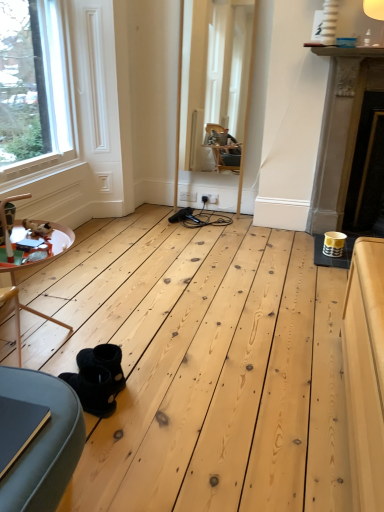
Question: Does clear glass window at upper left have a lesser width compared to gold metallic fireplace at right?

Choices:
 (A) yes
 (B) no

Answer: (A)

Question: From the image's perspective, is clear glass window at upper left located beneath gold metallic fireplace at right?

Choices:
 (A) yes
 (B) no

Answer: (B)

Question: Is clear glass window at upper left outside of gold metallic fireplace at right?

Choices:
 (A) no
 (B) yes

Answer: (B)

Question: Is clear glass window at upper left at the left side of gold metallic fireplace at right?

Choices:
 (A) yes
 (B) no

Answer: (A)

Question: Is clear glass window at upper left oriented towards gold metallic fireplace at right?

Choices:
 (A) yes
 (B) no

Answer: (A)

Question: From a real-world perspective, relative to wooden table at lower left, is clear glass window at upper left vertically above or below?

Choices:
 (A) above
 (B) below

Answer: (A)

Question: Looking at their shapes, would you say clear glass window at upper left is wider or thinner than wooden table at lower left?

Choices:
 (A) wide
 (B) thin

Answer: (B)

Question: Is clear glass window at upper left inside the boundaries of wooden table at lower left, or outside?

Choices:
 (A) outside
 (B) inside

Answer: (A)

Question: Would you say clear glass window at upper left is to the left or to the right of wooden table at lower left in the picture?

Choices:
 (A) right
 (B) left

Answer: (B)

Question: Is wooden table at lower left in front of or behind black suede boots at lower left in the image?

Choices:
 (A) behind
 (B) front

Answer: (B)

Question: From a real-world perspective, is wooden table at lower left above or below black suede boots at lower left?

Choices:
 (A) below
 (B) above

Answer: (B)

Question: Is wooden table at lower left bigger or smaller than black suede boots at lower left?

Choices:
 (A) big
 (B) small

Answer: (A)

Question: Considering the positions of wooden table at lower left and black suede boots at lower left in the image, is wooden table at lower left taller or shorter than black suede boots at lower left?

Choices:
 (A) tall
 (B) short

Answer: (A)

Question: In terms of width, does wooden table at lower left look wider or thinner when compared to gold metallic fireplace at right?

Choices:
 (A) wide
 (B) thin

Answer: (A)

Question: Based on their sizes in the image, would you say wooden table at lower left is bigger or smaller than gold metallic fireplace at right?

Choices:
 (A) big
 (B) small

Answer: (B)